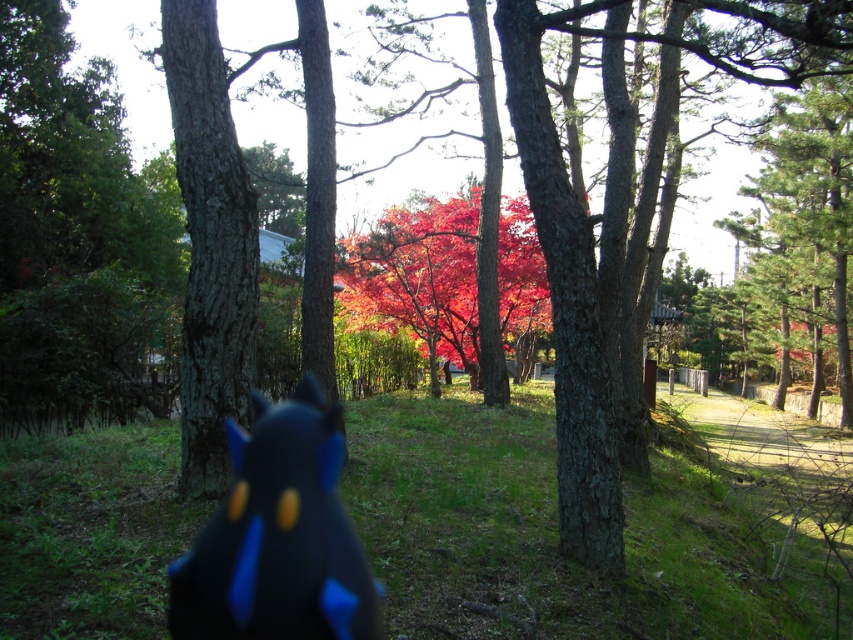
Between matte black plush toy at center and vivid red leaves at center, which one appears on the right side from the viewer's perspective?

vivid red leaves at center is more to the right.

Who is more forward, (345,634) or (408,212)?

Point (345,634)

You are a GUI agent. You are given a task and a screenshot of the screen. Output one action in this format:
    pyautogui.click(x=<x>, y=<y>)
    Task: Click on the matte black plush toy at center
    
    Given the screenshot: What is the action you would take?
    pyautogui.click(x=277, y=536)